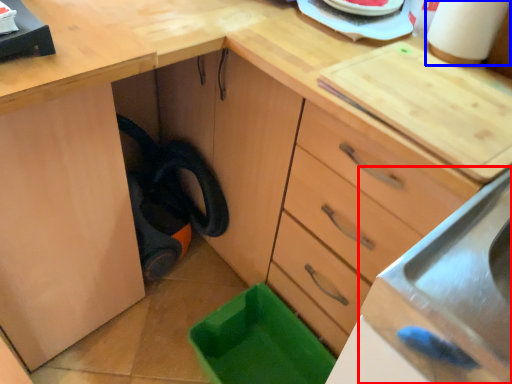
Question: Among these objects, which one is nearest to the camera, sink (highlighted by a red box) or paper towel (highlighted by a blue box)?

Choices:
 (A) sink
 (B) paper towel

Answer: (A)